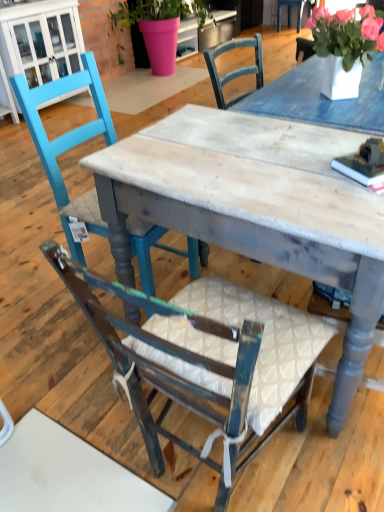
What do you see at coordinates (68, 145) in the screenshot?
I see `teal painted wood chair at left, the 2th chair when ordered from front to back` at bounding box center [68, 145].

The height and width of the screenshot is (512, 384). What do you see at coordinates (206, 356) in the screenshot?
I see `wooden chair with white cushion at center, the 1th chair when ordered from front to back` at bounding box center [206, 356].

What do you see at coordinates (345, 46) in the screenshot?
I see `white ceramic vase at upper right` at bounding box center [345, 46].

You are a GUI agent. You are given a task and a screenshot of the screen. Output one action in this format:
    pyautogui.click(x=<x>, y=<y>)
    Task: Click on the pink matte pot at upper center
    
    Given the screenshot: What is the action you would take?
    pyautogui.click(x=158, y=27)

Where is `teal painted wood chair at left, the 2th chair when ordered from front to back`? This screenshot has height=512, width=384. teal painted wood chair at left, the 2th chair when ordered from front to back is located at coordinates (68, 145).

Is distressed wood table at center inside the boundaries of pink matte pot at upper center, or outside?

distressed wood table at center is spatially situated outside pink matte pot at upper center.

Which of these two, distressed wood table at center or pink matte pot at upper center, is thinner?

pink matte pot at upper center is thinner.

Is distressed wood table at center not close to pink matte pot at upper center?

Yes.

Considering the positions of objects white ceramic vase at upper right and pink matte pot at upper center in the image provided, who is in front, white ceramic vase at upper right or pink matte pot at upper center?

white ceramic vase at upper right.

Is white ceramic vase at upper right not within pink matte pot at upper center?

Yes, white ceramic vase at upper right is located beyond the bounds of pink matte pot at upper center.

Where is `houseplant below the white ceramic vase at upper right (from a real-world perspective)`? The width and height of the screenshot is (384, 512). houseplant below the white ceramic vase at upper right (from a real-world perspective) is located at coordinates (158, 27).

Is pink matte pot at upper center inside or outside of distressed wood table at center?

pink matte pot at upper center is outside distressed wood table at center.

Which is further, (149, 12) or (122, 153)?

The point (149, 12) is behind.

Are pink matte pot at upper center and distressed wood table at center located far from each other?

Yes.

At what (x,y) coordinates should I click in order to perform the action: click on table below the pink matte pot at upper center (from the image's perspective). Please return your answer as a coordinate pair (x, y). Looking at the image, I should click on (258, 204).

Is point (343, 191) less distant than point (129, 237)?

Yes, point (343, 191) is closer to viewer.

Who is bigger, distressed wood table at center or teal painted wood chair at left, the 2th chair when ordered from front to back?

distressed wood table at center is bigger.

Does distressed wood table at center turn towards teal painted wood chair at left, marked as the 1th chair in a back-to-front arrangement?

Yes.

Locate an element on the screen. The width and height of the screenshot is (384, 512). table on the right of the teal painted wood chair at left, the 2th chair when ordered from front to back is located at coordinates [258, 204].

Considering the relative sizes of wooden chair with white cushion at center, which is the 2th chair from back to front, and white ceramic vase at upper right in the image provided, is wooden chair with white cushion at center, which is the 2th chair from back to front, taller than white ceramic vase at upper right?

Indeed, wooden chair with white cushion at center, which is the 2th chair from back to front, has a greater height compared to white ceramic vase at upper right.

You are a GUI agent. You are given a task and a screenshot of the screen. Output one action in this format:
    pyautogui.click(x=<x>, y=<y>)
    Task: Click on the 2nd chair positioned below the white ceramic vase at upper right (from a real-world perspective)
    
    Given the screenshot: What is the action you would take?
    pyautogui.click(x=206, y=356)

Is wooden chair with white cushion at center, the 1th chair when ordered from front to back, oriented towards white ceramic vase at upper right?

Yes, wooden chair with white cushion at center, the 1th chair when ordered from front to back, is facing white ceramic vase at upper right.

Is teal painted wood chair at left, marked as the 1th chair in a back-to-front arrangement, to the left of distressed wood table at center from the viewer's perspective?

Yes.

Is teal painted wood chair at left, marked as the 1th chair in a back-to-front arrangement, facing away from distressed wood table at center?

teal painted wood chair at left, marked as the 1th chair in a back-to-front arrangement, does not have its back to distressed wood table at center.

Which object is closer to the camera taking this photo, teal painted wood chair at left, the 2th chair when ordered from front to back, or distressed wood table at center?

distressed wood table at center is in front.

Considering the sizes of objects pink matte pot at upper center and white ceramic vase at upper right in the image provided, who is thinner, pink matte pot at upper center or white ceramic vase at upper right?

Thinner between the two is white ceramic vase at upper right.

Does pink matte pot at upper center have a lesser height compared to white ceramic vase at upper right?

No.

Can you confirm if pink matte pot at upper center is smaller than white ceramic vase at upper right?

Incorrect, pink matte pot at upper center is not smaller in size than white ceramic vase at upper right.

Where is `houseplant behind the distressed wood table at center`? This screenshot has height=512, width=384. houseplant behind the distressed wood table at center is located at coordinates (158, 27).

Where is `houseplant below the white ceramic vase at upper right (from a real-world perspective)`? This screenshot has width=384, height=512. houseplant below the white ceramic vase at upper right (from a real-world perspective) is located at coordinates (158, 27).

Based on their spatial positions, is wooden chair with white cushion at center, which is the 2th chair from back to front, or teal painted wood chair at left, marked as the 1th chair in a back-to-front arrangement, closer to white ceramic vase at upper right?

teal painted wood chair at left, marked as the 1th chair in a back-to-front arrangement, is closer to white ceramic vase at upper right.

Based on their spatial positions, is wooden chair with white cushion at center, the 1th chair when ordered from front to back, or pink matte pot at upper center further from distressed wood table at center?

pink matte pot at upper center is positioned further to the anchor distressed wood table at center.

Estimate the real-world distances between objects in this image. Which object is closer to white ceramic vase at upper right, distressed wood table at center or teal painted wood chair at left, marked as the 1th chair in a back-to-front arrangement?

distressed wood table at center is closer to white ceramic vase at upper right.

Based on their spatial positions, is distressed wood table at center or pink matte pot at upper center closer to teal painted wood chair at left, the 2th chair when ordered from front to back?

distressed wood table at center is closer to teal painted wood chair at left, the 2th chair when ordered from front to back.

Looking at the image, which one is located closer to white ceramic vase at upper right, teal painted wood chair at left, marked as the 1th chair in a back-to-front arrangement, or pink matte pot at upper center?

teal painted wood chair at left, marked as the 1th chair in a back-to-front arrangement, lies closer to white ceramic vase at upper right than the other object.

Considering their positions, is wooden chair with white cushion at center, which is the 2th chair from back to front, positioned closer to white ceramic vase at upper right than pink matte pot at upper center?

wooden chair with white cushion at center, which is the 2th chair from back to front, is positioned closer to the anchor white ceramic vase at upper right.

Based on their spatial positions, is wooden chair with white cushion at center, the 1th chair when ordered from front to back, or distressed wood table at center closer to white ceramic vase at upper right?

Based on the image, distressed wood table at center appears to be nearer to white ceramic vase at upper right.

Which object lies further to the anchor point pink matte pot at upper center, white ceramic vase at upper right or teal painted wood chair at left, marked as the 1th chair in a back-to-front arrangement?

white ceramic vase at upper right.

Identify the location of table between white ceramic vase at upper right and wooden chair with white cushion at center, the 1th chair when ordered from front to back, in the vertical direction. (258, 204).

Locate an element on the screen. The image size is (384, 512). chair between white ceramic vase at upper right and wooden chair with white cushion at center, which is the 2th chair from back to front, in the vertical direction is located at coordinates (68, 145).

Identify the location of chair located between wooden chair with white cushion at center, which is the 2th chair from back to front, and pink matte pot at upper center in the depth direction. pos(68,145).

Where is `chair between distressed wood table at center and pink matte pot at upper center from front to back`? This screenshot has width=384, height=512. chair between distressed wood table at center and pink matte pot at upper center from front to back is located at coordinates (68, 145).